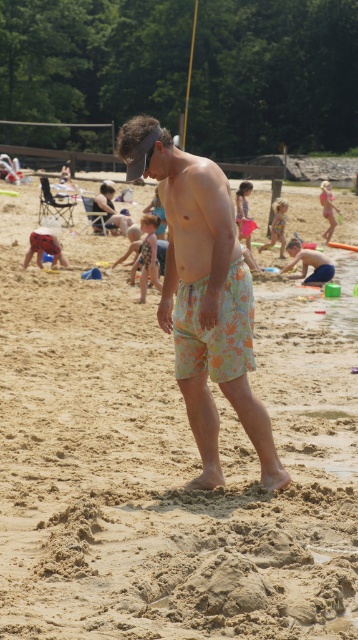
You are standing at the position marked by the point at coordinates [163,467]. Based on the scene description, what is the surface you are currently standing on?

The point at coordinates [163,467] corresponds to the beige sandy beach at center, so you are standing on the beige sandy beach at center.

You are a photographer trying to capture a photo of the floral swim trunks at center and the beige sandy beach at center. Which object is taller in the image?

The beige sandy beach at center is taller than the floral swim trunks at center.

You are standing on the beach and want to walk from the man to the children playing in the shallow water. Which direction should you move relative to the point at (12, 433) and the point at (185, 324)?

To reach the children playing in the shallow water, you should move away from the point at (12, 433) and toward the point at (185, 324) since the point at (12, 433) is closer to you and the point at (185, 324) is farther away.